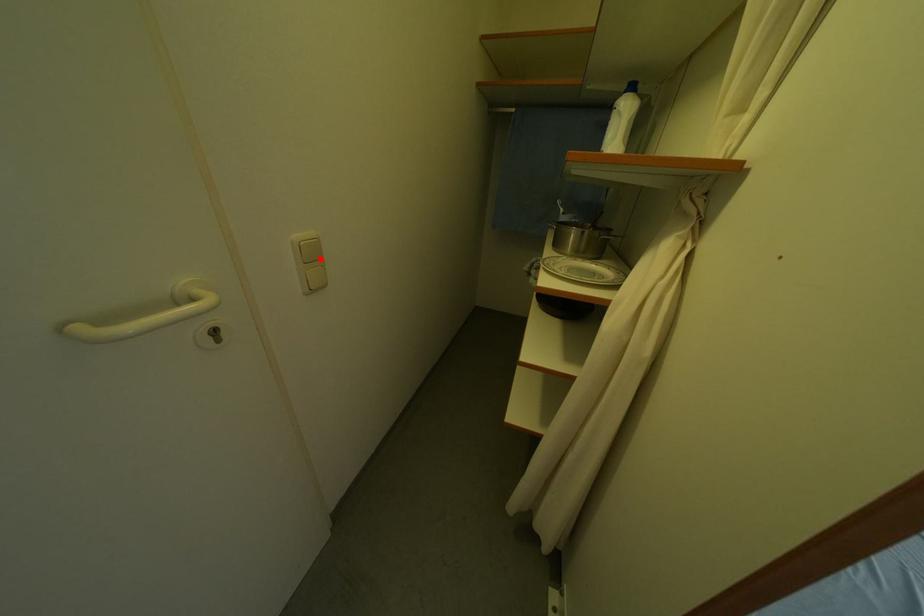
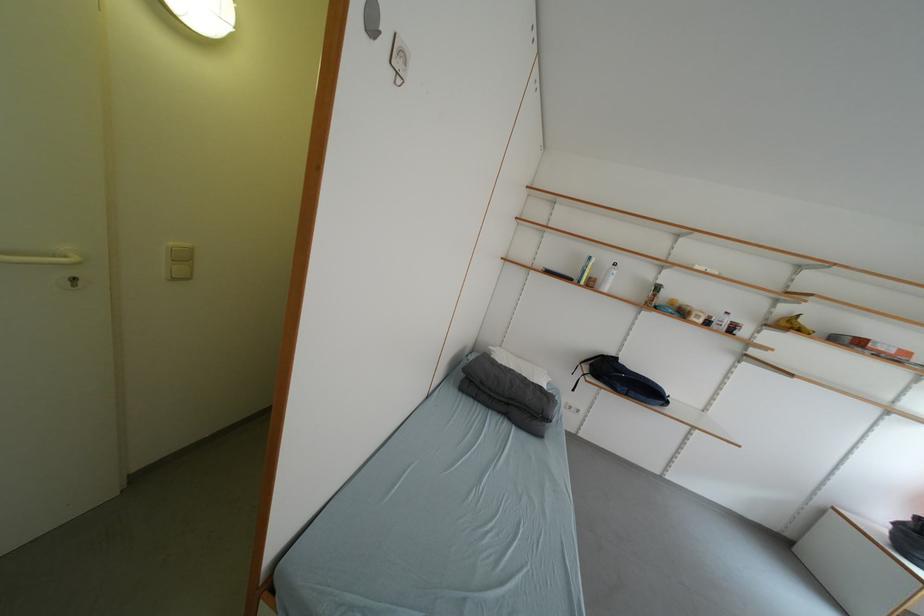
Locate, in the second image, the point that corresponds to the highlighted location in the first image.

(191, 261)